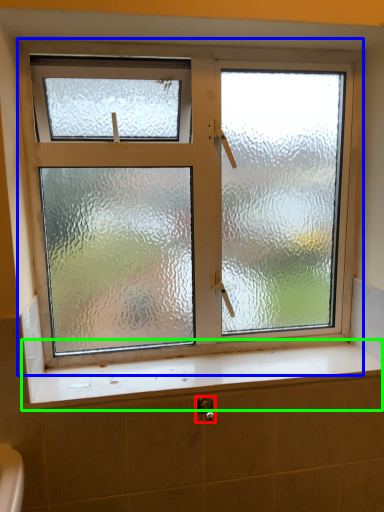
Question: Which object is positioned farthest from shower (highlighted by a red box)? Select from window (highlighted by a blue box) and window sill (highlighted by a green box).

Choices:
 (A) window
 (B) window sill

Answer: (A)